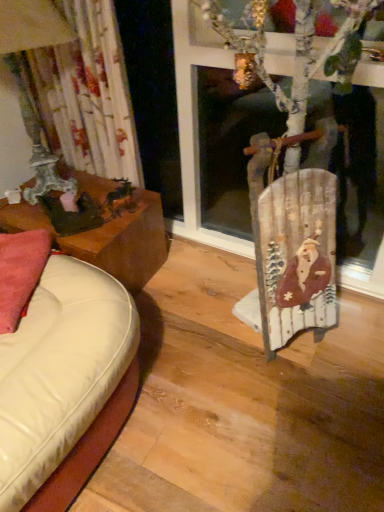
Identify the location of free space in front of wooden sled at right. (303, 393).